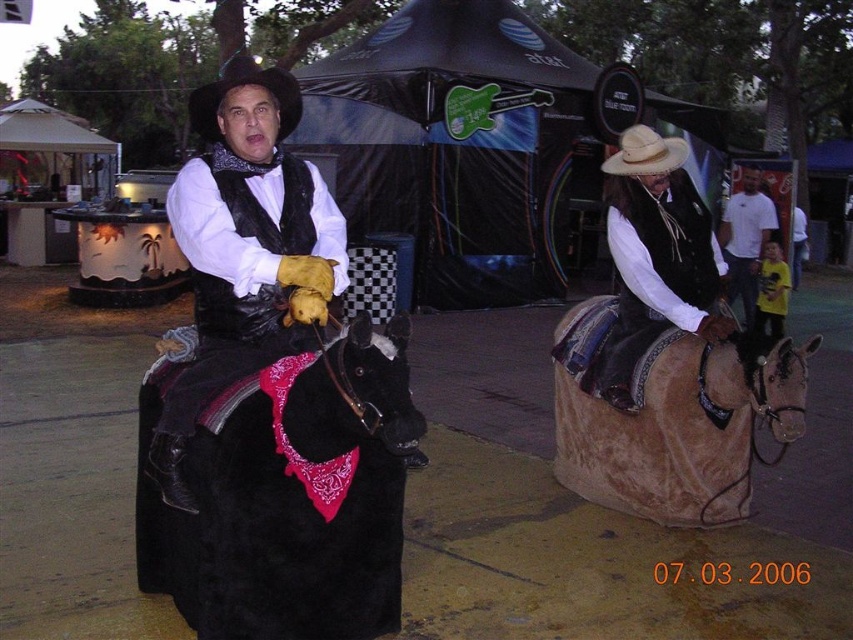
Who is lower down, brown suede horse at right or white cotton shirt at upper right?

brown suede horse at right is lower down.

Between brown suede horse at right and white cotton shirt at upper right, which one appears on the right side from the viewer's perspective?

white cotton shirt at upper right

Who is more forward, (647, 496) or (743, 234)?

Point (647, 496) is more forward.

What are the coordinates of `brown suede horse at right` in the screenshot? It's located at (677, 424).

Can you confirm if black velvet horse at left is bigger than natural straw cowboy hat at upper right?

Yes, black velvet horse at left is bigger than natural straw cowboy hat at upper right.

Which is behind, point (368, 362) or point (670, 147)?

The point (670, 147) is behind.

Image resolution: width=853 pixels, height=640 pixels. I want to click on black velvet horse at left, so point(287,493).

Is leather vest at center smaller than white cotton shirt at upper right?

Correct, leather vest at center occupies less space than white cotton shirt at upper right.

Does leather vest at center have a lesser width compared to white cotton shirt at upper right?

Yes, leather vest at center is thinner than white cotton shirt at upper right.

At what (x,y) coordinates should I click in order to perform the action: click on leather vest at center. Please return your answer as a coordinate pair (x, y). Looking at the image, I should click on (659, 272).

This screenshot has width=853, height=640. I want to click on leather vest at center, so click(659, 272).